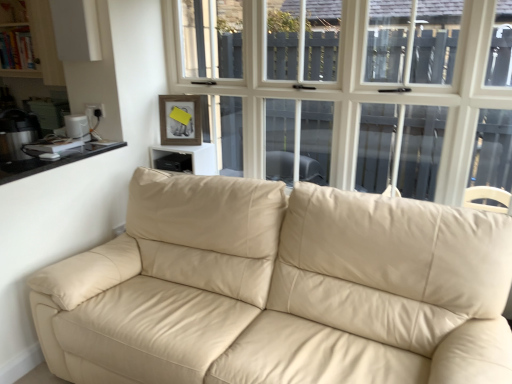
You are a GUI agent. You are given a task and a screenshot of the screen. Output one action in this format:
    pyautogui.click(x=<x>, y=<y>)
    Task: Click on the black plastic speaker at upper center
    This screenshot has height=384, width=512.
    Given the screenshot: What is the action you would take?
    pyautogui.click(x=191, y=157)

How much space does white plastic toaster at left, the second appliance when ordered from left to right, occupy vertically?

white plastic toaster at left, the second appliance when ordered from left to right, is 6.68 inches in height.

I want to click on white plastic toaster at left, which is the 1th appliance in right-to-left order, so click(77, 127).

Find the location of a particular element. metallic silver kettle at left, the second appliance when ordered from right to left is located at coordinates (16, 134).

This screenshot has height=384, width=512. In order to click on black glass counter top at left in this screenshot , I will do `click(52, 161)`.

In order to click on black plastic speaker at upper center in this screenshot , I will do point(191,157).

From the picture: Who is more distant, white plastic toaster at left, the second appliance when ordered from left to right, or beige leather couch at center?

white plastic toaster at left, the second appliance when ordered from left to right.

Is white plastic toaster at left, the second appliance when ordered from left to right, aimed at beige leather couch at center?

No, white plastic toaster at left, the second appliance when ordered from left to right, is not aimed at beige leather couch at center.

Looking at this image, from the image's perspective, relative to beige leather couch at center, is white plastic toaster at left, which is the 1th appliance in right-to-left order, above or below?

white plastic toaster at left, which is the 1th appliance in right-to-left order, is situated higher than beige leather couch at center in the image.

Would you say beige leather couch at center is part of white plastic toaster at left, which is the 1th appliance in right-to-left order,'s contents?

No, beige leather couch at center is located outside of white plastic toaster at left, which is the 1th appliance in right-to-left order.

Considering the points (68, 131) and (11, 156), which point is in front, point (68, 131) or point (11, 156)?

Positioned in front is point (11, 156).

Could you tell me if white plastic toaster at left, which is the 1th appliance in right-to-left order, is turned towards metallic silver kettle at left, the second appliance when ordered from right to left?

No, white plastic toaster at left, which is the 1th appliance in right-to-left order, is not oriented towards metallic silver kettle at left, the second appliance when ordered from right to left.

Consider the image. From a real-world perspective, is white plastic toaster at left, which is the 1th appliance in right-to-left order, above or below metallic silver kettle at left, the second appliance when ordered from right to left?

In terms of real-world spatial position, white plastic toaster at left, which is the 1th appliance in right-to-left order, is above metallic silver kettle at left, the second appliance when ordered from right to left.

Is black plastic speaker at upper center completely or partially outside of beige leather couch at center?

Yes, black plastic speaker at upper center is outside of beige leather couch at center.

In the scene shown: Is black plastic speaker at upper center far away from beige leather couch at center?

Yes, black plastic speaker at upper center is far from beige leather couch at center.

From the image's perspective, is black plastic speaker at upper center above beige leather couch at center?

Correct, black plastic speaker at upper center appears higher than beige leather couch at center in the image.

From a real-world perspective, does black plastic speaker at upper center sit lower than beige leather couch at center?

No, from a real-world perspective, black plastic speaker at upper center is not beneath beige leather couch at center.

Is beige leather couch at center placed right next to black glass counter top at left?

beige leather couch at center and black glass counter top at left are clearly separated.

Looking at this image, is beige leather couch at center located outside black glass counter top at left?

Yes, beige leather couch at center is not within black glass counter top at left.

What are the coordinates of `studio couch below the black glass counter top at left (from the image's perspective)` in the screenshot? It's located at (276, 288).

Which object is positioned more to the left, white plastic toaster at left, which is the 1th appliance in right-to-left order, or black plastic speaker at upper center?

white plastic toaster at left, which is the 1th appliance in right-to-left order, is more to the left.

From a real-world perspective, is white plastic toaster at left, which is the 1th appliance in right-to-left order, positioned under black plastic speaker at upper center based on gravity?

No, from a real-world perspective, white plastic toaster at left, which is the 1th appliance in right-to-left order, is not under black plastic speaker at upper center.

Measure the distance between white plastic toaster at left, the second appliance when ordered from left to right, and black plastic speaker at upper center.

white plastic toaster at left, the second appliance when ordered from left to right, and black plastic speaker at upper center are 23.13 inches apart.

Is point (66, 119) more distant than point (212, 157)?

No, (66, 119) is in front of (212, 157).

Is beige leather couch at center looking in the opposite direction of white plastic toaster at left, which is the 1th appliance in right-to-left order?

No, white plastic toaster at left, which is the 1th appliance in right-to-left order, is not at the back of beige leather couch at center.

At what (x,y) coordinates should I click in order to perform the action: click on appliance that is the 1st object to the left of the beige leather couch at center, starting at the anchor. Please return your answer as a coordinate pair (x, y). Image resolution: width=512 pixels, height=384 pixels. Looking at the image, I should click on (77, 127).

How different are the orientations of beige leather couch at center and white plastic toaster at left, which is the 1th appliance in right-to-left order, in degrees?

There is a 93.2-degree angle between the facing directions of beige leather couch at center and white plastic toaster at left, which is the 1th appliance in right-to-left order.

Is metallic silver kettle at left, the second appliance when ordered from right to left, positioned behind beige leather couch at center?

Yes, the depth of metallic silver kettle at left, the second appliance when ordered from right to left, is greater than that of beige leather couch at center.

Considering the sizes of objects metallic silver kettle at left, arranged as the 1th appliance when viewed from the left, and beige leather couch at center in the image provided, who is thinner, metallic silver kettle at left, arranged as the 1th appliance when viewed from the left, or beige leather couch at center?

metallic silver kettle at left, arranged as the 1th appliance when viewed from the left, is thinner.

From the image's perspective, would you say metallic silver kettle at left, arranged as the 1th appliance when viewed from the left, is shown under beige leather couch at center?

No, from the image's perspective, metallic silver kettle at left, arranged as the 1th appliance when viewed from the left, is not beneath beige leather couch at center.

Between metallic silver kettle at left, the second appliance when ordered from right to left, and beige leather couch at center, which one appears on the left side from the viewer's perspective?

metallic silver kettle at left, the second appliance when ordered from right to left, is more to the left.

This screenshot has width=512, height=384. What are the coordinates of `appliance that is the 2nd object above the beige leather couch at center (from a real-world perspective)` in the screenshot? It's located at (77, 127).

Where is `appliance on the right of metallic silver kettle at left, arranged as the 1th appliance when viewed from the left`? appliance on the right of metallic silver kettle at left, arranged as the 1th appliance when viewed from the left is located at coordinates (77, 127).

Looking at the image, which one is located closer to black glass counter top at left, white plastic toaster at left, the second appliance when ordered from left to right, or black plastic speaker at upper center?

white plastic toaster at left, the second appliance when ordered from left to right, is positioned closer to the anchor black glass counter top at left.

Considering their positions, is black plastic speaker at upper center positioned closer to white plastic toaster at left, which is the 1th appliance in right-to-left order, than metallic silver kettle at left, the second appliance when ordered from right to left?

metallic silver kettle at left, the second appliance when ordered from right to left, lies closer to white plastic toaster at left, which is the 1th appliance in right-to-left order, than the other object.

Which object lies further to the anchor point beige leather couch at center, white plastic toaster at left, which is the 1th appliance in right-to-left order, or metallic silver kettle at left, the second appliance when ordered from right to left?

The object further to beige leather couch at center is white plastic toaster at left, which is the 1th appliance in right-to-left order.

Which object lies further to the anchor point black glass counter top at left, beige leather couch at center or metallic silver kettle at left, the second appliance when ordered from right to left?

beige leather couch at center is positioned further to the anchor black glass counter top at left.

Which object lies nearer to the anchor point metallic silver kettle at left, arranged as the 1th appliance when viewed from the left, black plastic speaker at upper center or beige leather couch at center?

Based on the image, black plastic speaker at upper center appears to be nearer to metallic silver kettle at left, arranged as the 1th appliance when viewed from the left.

When comparing their distances from black plastic speaker at upper center, does metallic silver kettle at left, the second appliance when ordered from right to left, or white plastic toaster at left, the second appliance when ordered from left to right, seem further?

metallic silver kettle at left, the second appliance when ordered from right to left, is positioned further to the anchor black plastic speaker at upper center.

Looking at the image, which one is located closer to metallic silver kettle at left, the second appliance when ordered from right to left, beige leather couch at center or white plastic toaster at left, the second appliance when ordered from left to right?

The object closer to metallic silver kettle at left, the second appliance when ordered from right to left, is white plastic toaster at left, the second appliance when ordered from left to right.

Considering their positions, is beige leather couch at center positioned closer to metallic silver kettle at left, the second appliance when ordered from right to left, than black plastic speaker at upper center?

black plastic speaker at upper center is positioned closer to the anchor metallic silver kettle at left, the second appliance when ordered from right to left.

Identify the location of counter top between beige leather couch at center and black plastic speaker at upper center in the front-back direction. (52, 161).

Identify the location of counter top situated between metallic silver kettle at left, arranged as the 1th appliance when viewed from the left, and black plastic speaker at upper center from left to right. (52, 161).

Locate an element on the screen. counter top located between beige leather couch at center and white plastic toaster at left, which is the 1th appliance in right-to-left order, in the depth direction is located at coordinates (52, 161).

The height and width of the screenshot is (384, 512). Identify the location of counter top between metallic silver kettle at left, the second appliance when ordered from right to left, and beige leather couch at center from left to right. click(x=52, y=161).